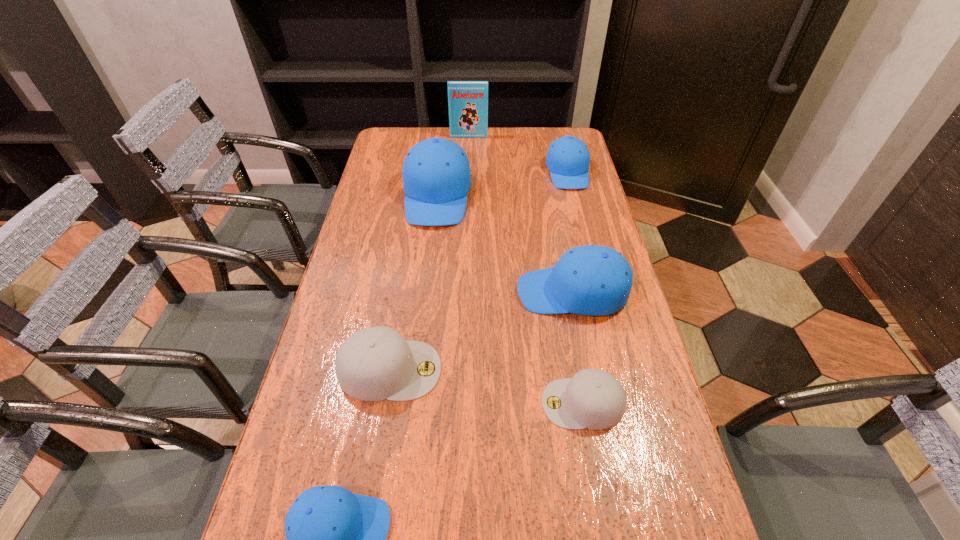
You are a GUI agent. You are given a task and a screenshot of the screen. Output one action in this format:
    pyautogui.click(x=<x>, y=<y>)
    Task: Click on the free space between the fourth nearest cap and the second smallest blue cap
    The width and height of the screenshot is (960, 540).
    Given the screenshot: What is the action you would take?
    pyautogui.click(x=570, y=232)

Locate an element on the screen. empty space between the sixth shortest object and the fifth shortest object is located at coordinates (505, 244).

The height and width of the screenshot is (540, 960). I want to click on object that is the third closest to the nearest cap, so click(x=590, y=280).

Select which object is the second closest to the blue book. Please provide its 2D coordinates. Your answer should be formatted as a tuple, i.e. [(x, y)], where the tuple contains the x and y coordinates of a point satisfying the conditions above.

[(568, 158)]

Identify which cap is the second closest to the bigger gray cap. Please provide its 2D coordinates. Your answer should be formatted as a tuple, i.e. [(x, y)], where the tuple contains the x and y coordinates of a point satisfying the conditions above.

[(590, 280)]

Find the location of a particular element. This screenshot has width=960, height=540. cap object that ranks as the sixth closest to the book is located at coordinates (336, 539).

This screenshot has height=540, width=960. In order to click on the second closest blue cap to the third farthest blue cap in this screenshot , I will do [x=568, y=158].

You are a GUI agent. You are given a task and a screenshot of the screen. Output one action in this format:
    pyautogui.click(x=<x>, y=<y>)
    Task: Click on the closest blue cap to the biggest blue cap
    
    Given the screenshot: What is the action you would take?
    pyautogui.click(x=590, y=280)

Find the location of `blank area in the image that satisfies the following two spatial constraints: 1. on the front-facing side of the third biggest blue cap; 2. on the front-facing side of the left gray cap`. blank area in the image that satisfies the following two spatial constraints: 1. on the front-facing side of the third biggest blue cap; 2. on the front-facing side of the left gray cap is located at coordinates [x=617, y=369].

Locate an element on the screen. This screenshot has width=960, height=540. free space that satisfies the following two spatial constraints: 1. on the front-facing side of the third biggest blue cap; 2. on the front-facing side of the fourth farthest object is located at coordinates (598, 292).